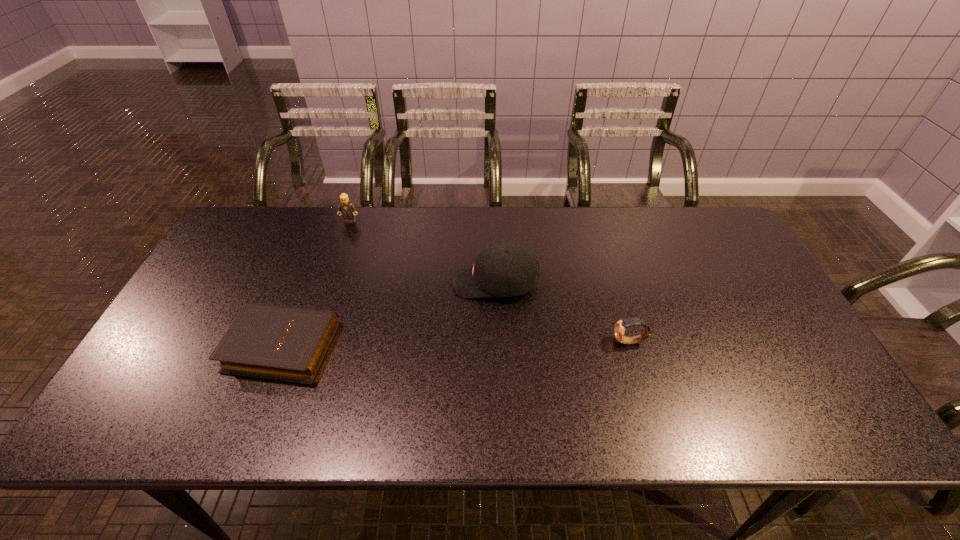
Locate an element on the screen. The width and height of the screenshot is (960, 540). vacant area situated in front of the third shortest object is located at coordinates (330, 281).

Find the location of a particular element. The width and height of the screenshot is (960, 540). vacant area situated on the face of the rightmost object is located at coordinates (462, 342).

Image resolution: width=960 pixels, height=540 pixels. What are the coordinates of `vacant region located on the face of the rightmost object` in the screenshot? It's located at (505, 342).

Locate an element on the screen. The height and width of the screenshot is (540, 960). vacant space located 0.300m on the face of the rightmost object is located at coordinates (497, 342).

The width and height of the screenshot is (960, 540). Find the location of `vacant space located on the back of the Bible`. vacant space located on the back of the Bible is located at coordinates (307, 284).

Find the location of `object situated at the far edge`. object situated at the far edge is located at coordinates (346, 208).

In the image, there is a desktop. At what (x,y) coordinates should I click in order to perform the action: click on vacant space at the far edge. Please return your answer as a coordinate pair (x, y). Image resolution: width=960 pixels, height=540 pixels. Looking at the image, I should click on (580, 210).

The height and width of the screenshot is (540, 960). In the image, there is a desktop. What are the coordinates of `vacant space at the near edge` in the screenshot? It's located at [561, 415].

The width and height of the screenshot is (960, 540). I want to click on free space at the left edge of the desktop, so click(203, 378).

I want to click on vacant point at the right edge, so click(x=746, y=299).